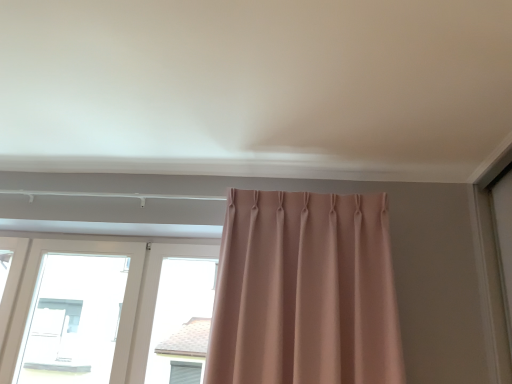
Question: Should I look upward or downward to see matte pink curtain at center?

Choices:
 (A) down
 (B) up

Answer: (A)

Question: Can you confirm if white plastic window at left is wider than matte pink curtain at center?

Choices:
 (A) no
 (B) yes

Answer: (B)

Question: Is white plastic window at left outside of matte pink curtain at center?

Choices:
 (A) yes
 (B) no

Answer: (A)

Question: From a real-world perspective, is white plastic window at left positioned under matte pink curtain at center based on gravity?

Choices:
 (A) no
 (B) yes

Answer: (B)

Question: Is white plastic window at left to the right of matte pink curtain at center from the viewer's perspective?

Choices:
 (A) yes
 (B) no

Answer: (B)

Question: Is white plastic window at left far from matte pink curtain at center?

Choices:
 (A) yes
 (B) no

Answer: (B)

Question: Is white plastic window at left shorter than matte pink curtain at center?

Choices:
 (A) yes
 (B) no

Answer: (A)

Question: Does matte pink curtain at center appear on the right side of white plastic window at left?

Choices:
 (A) no
 (B) yes

Answer: (B)

Question: Could you tell me if matte pink curtain at center is facing white plastic window at left?

Choices:
 (A) yes
 (B) no

Answer: (B)

Question: Does matte pink curtain at center come in front of white plastic window at left?

Choices:
 (A) no
 (B) yes

Answer: (B)

Question: Is matte pink curtain at center far from white plastic window at left?

Choices:
 (A) yes
 (B) no

Answer: (B)

Question: Would you say matte pink curtain at center contains white plastic window at left?

Choices:
 (A) yes
 (B) no

Answer: (B)

Question: Is matte pink curtain at center looking in the opposite direction of white plastic window at left?

Choices:
 (A) no
 (B) yes

Answer: (A)

Question: In the image, is white plastic window at left positioned in front of or behind matte pink curtain at center?

Choices:
 (A) behind
 (B) front

Answer: (A)